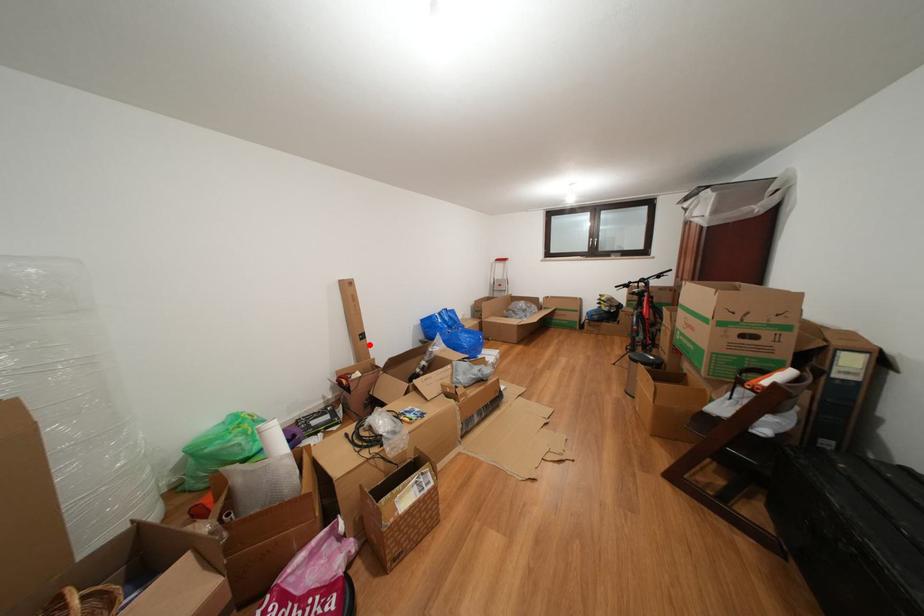
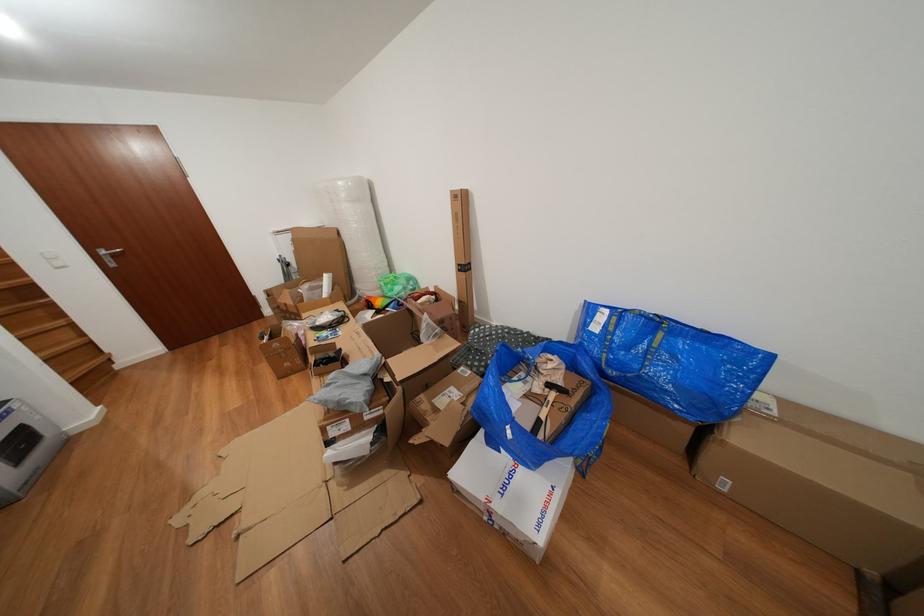
Where in the second image is the point corresponding to the highlighted location from the first image?

(468, 276)